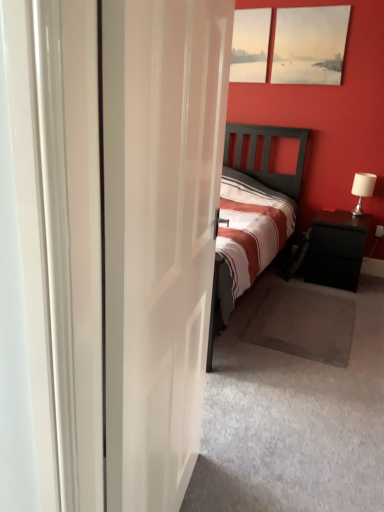
Question: In which direction should I rotate to look at matte wooden picture frame at upper center, the 1th picture frame from the left?

Choices:
 (A) right
 (B) left

Answer: (A)

Question: From the image's perspective, is white glossy door at center under matte canvas painting at upper right, which appears as the second picture frame when viewed from the left?

Choices:
 (A) no
 (B) yes

Answer: (B)

Question: Can you confirm if white glossy door at center is wider than matte canvas painting at upper right, which appears as the second picture frame when viewed from the left?

Choices:
 (A) yes
 (B) no

Answer: (A)

Question: Would you say matte canvas painting at upper right, the 1th picture frame positioned from the right, is part of white glossy door at center's contents?

Choices:
 (A) no
 (B) yes

Answer: (A)

Question: Can you confirm if white glossy door at center is smaller than matte canvas painting at upper right, which appears as the second picture frame when viewed from the left?

Choices:
 (A) no
 (B) yes

Answer: (A)

Question: Is white glossy door at center taller than matte canvas painting at upper right, the 1th picture frame positioned from the right?

Choices:
 (A) yes
 (B) no

Answer: (A)

Question: Can you confirm if white glossy door at center is bigger than matte canvas painting at upper right, which appears as the second picture frame when viewed from the left?

Choices:
 (A) yes
 (B) no

Answer: (A)

Question: Is white glossy door at center shorter than white fabric lampshade at right?

Choices:
 (A) no
 (B) yes

Answer: (A)

Question: Considering the relative positions of white glossy door at center and white fabric lampshade at right in the image provided, is white glossy door at center to the right of white fabric lampshade at right from the viewer's perspective?

Choices:
 (A) yes
 (B) no

Answer: (B)

Question: From the image's perspective, is white glossy door at center under white fabric lampshade at right?

Choices:
 (A) yes
 (B) no

Answer: (A)

Question: Is white glossy door at center facing away from white fabric lampshade at right?

Choices:
 (A) no
 (B) yes

Answer: (A)

Question: Considering the relative sizes of white glossy door at center and white fabric lampshade at right in the image provided, is white glossy door at center smaller than white fabric lampshade at right?

Choices:
 (A) no
 (B) yes

Answer: (A)

Question: Is white glossy door at center not close to white fabric lampshade at right?

Choices:
 (A) no
 (B) yes

Answer: (B)

Question: Could you tell me if black matte nightstand at right is facing matte wooden picture frame at upper center, which ranks as the second picture frame in right-to-left order?

Choices:
 (A) yes
 (B) no

Answer: (B)